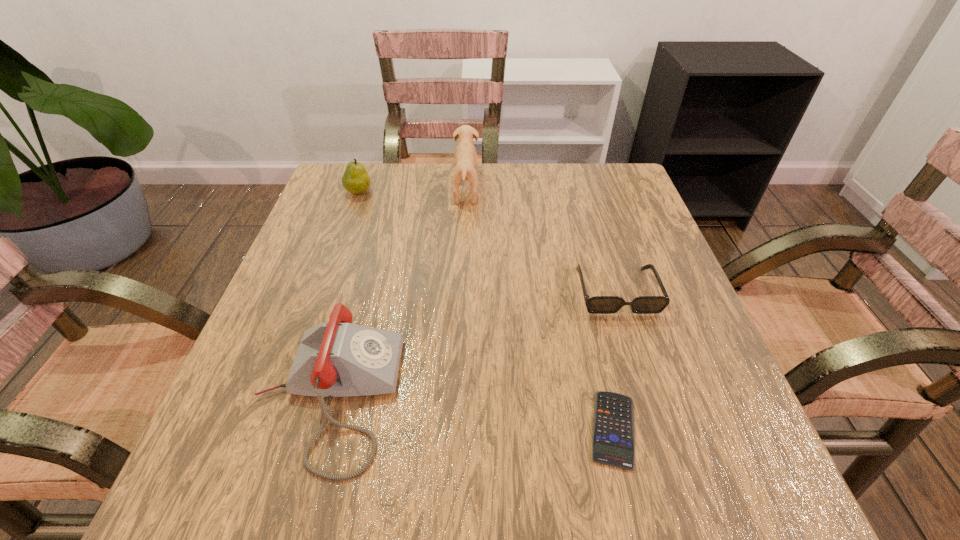
Locate an element on the screen. vacant space located 0.250m on the front-facing side of the fourth tallest object is located at coordinates (664, 448).

This screenshot has width=960, height=540. What are the coordinates of `free space located 0.050m on the left of the shortest object` in the screenshot? It's located at (553, 429).

At what (x,y) coordinates should I click in order to perform the action: click on puppy at the far edge. Please return your answer as a coordinate pair (x, y). Image resolution: width=960 pixels, height=540 pixels. Looking at the image, I should click on (465, 154).

At what (x,y) coordinates should I click in order to perform the action: click on pear that is at the far edge. Please return your answer as a coordinate pair (x, y). The height and width of the screenshot is (540, 960). Looking at the image, I should click on (355, 180).

You are a GUI agent. You are given a task and a screenshot of the screen. Output one action in this format:
    pyautogui.click(x=<x>, y=<y>)
    Task: Click on the telephone situated at the near edge
    This screenshot has height=540, width=960.
    Given the screenshot: What is the action you would take?
    pyautogui.click(x=336, y=359)

Locate an element on the screen. The height and width of the screenshot is (540, 960). calculator situated at the near edge is located at coordinates (613, 437).

At what (x,y) coordinates should I click in order to perform the action: click on pear located in the left edge section of the desktop. Please return your answer as a coordinate pair (x, y). Image resolution: width=960 pixels, height=540 pixels. Looking at the image, I should click on (355, 180).

At what (x,y) coordinates should I click in order to perform the action: click on telephone that is at the left edge. Please return your answer as a coordinate pair (x, y). The image size is (960, 540). Looking at the image, I should click on (336, 359).

Where is `sunglasses that is at the right edge`? This screenshot has width=960, height=540. sunglasses that is at the right edge is located at coordinates (598, 304).

Image resolution: width=960 pixels, height=540 pixels. Identify the location of calculator at the right edge. (613, 437).